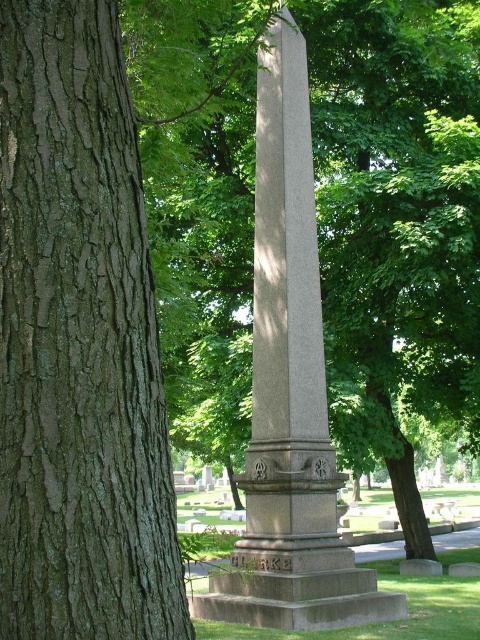
Is brown rough bark at left shorter than gray stone obelisk at center?

Yes, brown rough bark at left is shorter than gray stone obelisk at center.

Which is below, brown rough bark at left or gray stone obelisk at center?

brown rough bark at left

At what (x,y) coordinates should I click in order to perform the action: click on brown rough bark at left. Please return your answer as a coordinate pair (x, y). Looking at the image, I should click on (79, 342).

The image size is (480, 640). Identify the location of brown rough bark at left. (79, 342).